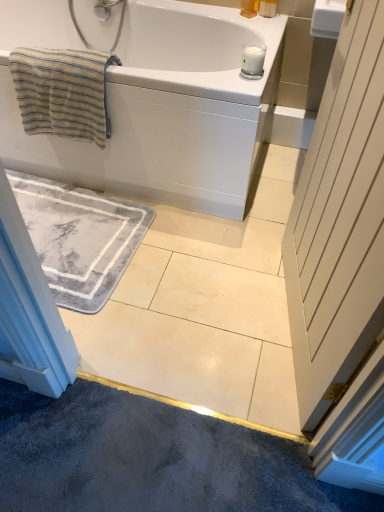
Locate an element on the screen. gray plush bath mat at lower left is located at coordinates (80, 237).

The height and width of the screenshot is (512, 384). What do you see at coordinates (80, 237) in the screenshot?
I see `gray plush bath mat at lower left` at bounding box center [80, 237].

Measure the distance between matte yellow soap at upper center, acting as the first toiletry starting from the left, and camera.

matte yellow soap at upper center, acting as the first toiletry starting from the left, and camera are 1.78 meters apart from each other.

How much space does matte yellow soap at upper center, acting as the first toiletry starting from the left, occupy vertically?

7.05 inches.

This screenshot has width=384, height=512. I want to click on beige striped towel at upper left, so click(x=63, y=92).

What are the coordinates of `white matte glass at upper center` in the screenshot? It's located at (253, 60).

Looking at this image, does white glossy bathtub at upper center turn towards white matte glass at upper center?

No.

Considering the relative sizes of white glossy bathtub at upper center and white matte glass at upper center in the image provided, is white glossy bathtub at upper center bigger than white matte glass at upper center?

Yes.

From the picture: Which is correct: white glossy bathtub at upper center is inside white matte glass at upper center, or outside of it?

white glossy bathtub at upper center is outside white matte glass at upper center.

Which is behind, white glossy bathtub at upper center or white matte glass at upper center?

white matte glass at upper center is further away from the camera.

From the picture: From the image's perspective, relative to white glossy bathtub at upper center, is matte plastic soap at upper right, the second toiletry in the left-to-right sequence, above or below?

Based on their image positions, matte plastic soap at upper right, the second toiletry in the left-to-right sequence, is located above white glossy bathtub at upper center.

Which is in front, matte plastic soap at upper right, the second toiletry in the left-to-right sequence, or white glossy bathtub at upper center?

white glossy bathtub at upper center is in front.

Considering the points (261, 0) and (208, 97), which point is in front, point (261, 0) or point (208, 97)?

The point (208, 97) is more forward.

Which of these two, matte plastic soap at upper right, the second toiletry in the left-to-right sequence, or white glossy bathtub at upper center, is wider?

white glossy bathtub at upper center is wider.

Based on the photo, would you consider white matte glass at upper center to be distant from matte yellow soap at upper center, acting as the first toiletry starting from the left?

No, white matte glass at upper center is not far from matte yellow soap at upper center, acting as the first toiletry starting from the left.

Does white matte glass at upper center turn towards matte yellow soap at upper center, the second toiletry viewed from the right?

No, white matte glass at upper center does not turn towards matte yellow soap at upper center, the second toiletry viewed from the right.

How much distance is there between white matte glass at upper center and matte yellow soap at upper center, the second toiletry viewed from the right?

white matte glass at upper center is 16.71 inches from matte yellow soap at upper center, the second toiletry viewed from the right.

Which is closer, (249, 51) or (243, 2)?

Point (249, 51).

Does matte yellow soap at upper center, the second toiletry viewed from the right, turn towards beige striped towel at upper left?

Yes, matte yellow soap at upper center, the second toiletry viewed from the right, is facing beige striped towel at upper left.

How distant is matte yellow soap at upper center, the second toiletry viewed from the right, from beige striped towel at upper left?

33.51 inches.

Is point (249, 8) closer to viewer compared to point (86, 103)?

No.

Which object is positioned more to the left, white glossy bathtub at upper center or beige striped towel at upper left?

beige striped towel at upper left is more to the left.

Is white glossy bathtub at upper center oriented away from beige striped towel at upper left?

No, white glossy bathtub at upper center's orientation is not away from beige striped towel at upper left.

Measure the distance from white glossy bathtub at upper center to beige striped towel at upper left.

white glossy bathtub at upper center and beige striped towel at upper left are 10.39 inches apart from each other.

Is white glossy bathtub at upper center far away from beige striped towel at upper left?

No, there isn't a large distance between white glossy bathtub at upper center and beige striped towel at upper left.

Identify the location of beach towel that is above the white wooden door at right (from the image's perspective). This screenshot has height=512, width=384. (63, 92).

Could you tell me if white wooden door at right is facing beige striped towel at upper left?

Yes, white wooden door at right is oriented towards beige striped towel at upper left.

Between white wooden door at right and beige striped towel at upper left, which one is positioned in front?

white wooden door at right is in front.

Is point (371, 136) in front of point (21, 114)?

Yes, it is in front of point (21, 114).

From the image's perspective, would you say white wooden door at right is shown under white matte glass at upper center?

Indeed, from the image's perspective, white wooden door at right is shown beneath white matte glass at upper center.

Is white wooden door at right positioned with its back to white matte glass at upper center?

white wooden door at right is not turned away from white matte glass at upper center.

Locate an element on the screen. This screenshot has width=384, height=512. door on the right of white matte glass at upper center is located at coordinates (339, 222).

This screenshot has height=512, width=384. In order to click on candle on the right of white glossy bathtub at upper center in this screenshot , I will do `click(253, 60)`.

Find the location of a particular element. The image size is (384, 512). bathtub below the matte plastic soap at upper right, placed as the 1th toiletry when sorted from right to left (from a real-world perspective) is located at coordinates (155, 103).

Looking at the image, which one is located further to white glossy bathtub at upper center, matte yellow soap at upper center, acting as the first toiletry starting from the left, or gray plush bath mat at lower left?

Based on the image, matte yellow soap at upper center, acting as the first toiletry starting from the left, appears to be further to white glossy bathtub at upper center.

When comparing their distances from gray plush bath mat at lower left, does white wooden door at right or white matte glass at upper center seem further?

white wooden door at right is further to gray plush bath mat at lower left.

Which object lies further to the anchor point gray plush bath mat at lower left, matte plastic soap at upper right, the second toiletry in the left-to-right sequence, or white wooden door at right?

The object further to gray plush bath mat at lower left is matte plastic soap at upper right, the second toiletry in the left-to-right sequence.

Estimate the real-world distances between objects in this image. Which object is closer to matte yellow soap at upper center, the second toiletry viewed from the right, white wooden door at right or gray plush bath mat at lower left?

The object closer to matte yellow soap at upper center, the second toiletry viewed from the right, is gray plush bath mat at lower left.

When comparing their distances from beige striped towel at upper left, does matte plastic soap at upper right, placed as the 1th toiletry when sorted from right to left, or gray plush bath mat at lower left seem closer?

Based on the image, gray plush bath mat at lower left appears to be nearer to beige striped towel at upper left.

Based on their spatial positions, is white glossy bathtub at upper center or white matte glass at upper center further from beige striped towel at upper left?

white matte glass at upper center is further to beige striped towel at upper left.

From the image, which object appears to be nearer to matte plastic soap at upper right, the second toiletry in the left-to-right sequence, gray plush bath mat at lower left or white matte glass at upper center?

The object closer to matte plastic soap at upper right, the second toiletry in the left-to-right sequence, is white matte glass at upper center.

Looking at the image, which one is located further to white matte glass at upper center, matte plastic soap at upper right, placed as the 1th toiletry when sorted from right to left, or matte yellow soap at upper center, the second toiletry viewed from the right?

Among the two, matte plastic soap at upper right, placed as the 1th toiletry when sorted from right to left, is located further to white matte glass at upper center.

Where is `candle located between white glossy bathtub at upper center and matte yellow soap at upper center, acting as the first toiletry starting from the left, in the left-right direction`? The height and width of the screenshot is (512, 384). candle located between white glossy bathtub at upper center and matte yellow soap at upper center, acting as the first toiletry starting from the left, in the left-right direction is located at coordinates (253, 60).

Where is `beach towel positioned between white wooden door at right and matte yellow soap at upper center, the second toiletry viewed from the right, from near to far`? beach towel positioned between white wooden door at right and matte yellow soap at upper center, the second toiletry viewed from the right, from near to far is located at coordinates (63, 92).

I want to click on candle located between beige striped towel at upper left and matte yellow soap at upper center, acting as the first toiletry starting from the left, in the left-right direction, so click(253, 60).

At what (x,y) coordinates should I click in order to perform the action: click on bathtub between beige striped towel at upper left and white matte glass at upper center. Please return your answer as a coordinate pair (x, y). Looking at the image, I should click on (155, 103).